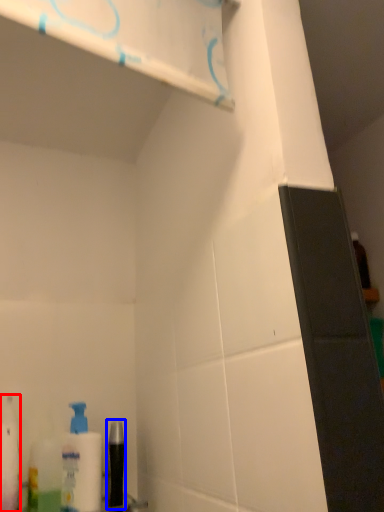
Question: Which object appears closest to the camera in this image, toiletry (highlighted by a red box) or mouthwash (highlighted by a blue box)?

Choices:
 (A) toiletry
 (B) mouthwash

Answer: (A)